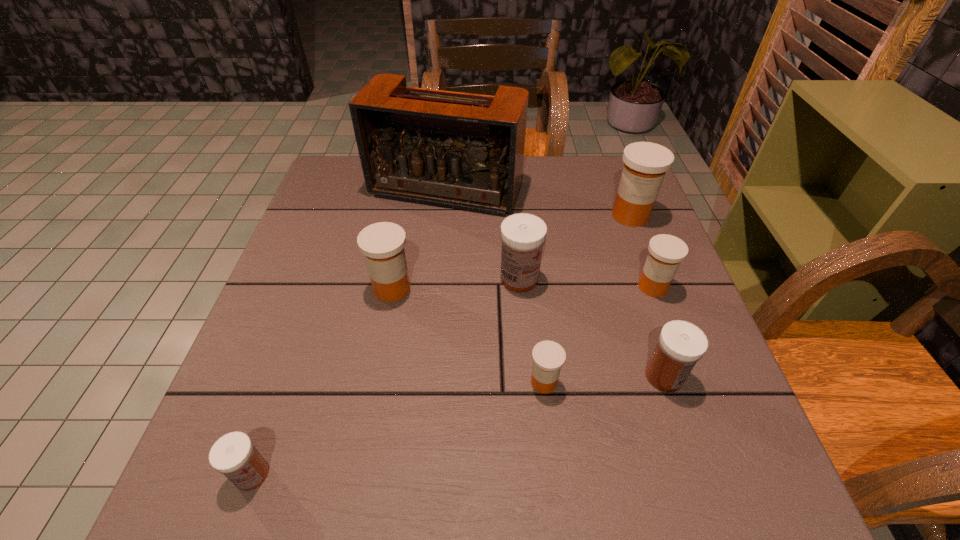
Where is `vacant space located on the label of the nearest orange medicine`? This screenshot has height=540, width=960. vacant space located on the label of the nearest orange medicine is located at coordinates (322, 382).

Find the location of `vacant region located on the label of the nearest orange medicine`. vacant region located on the label of the nearest orange medicine is located at coordinates (360, 382).

Find the location of a particular element. The image size is (960, 540). vacant space located 0.240m on the label of the nearest orange medicine is located at coordinates (397, 382).

At what (x,y) coordinates should I click in order to perform the action: click on free location located on the back of the leftmost white medicine. Please return your answer as a coordinate pair (x, y). Looking at the image, I should click on (x=312, y=302).

You are a GUI agent. You are given a task and a screenshot of the screen. Output one action in this format:
    pyautogui.click(x=<x>, y=<y>)
    Task: Click on the radio receiver that is at the far edge
    
    Given the screenshot: What is the action you would take?
    point(465,151)

At what (x,y) coordinates should I click in order to perform the action: click on medicine located at the far edge. Please return your answer as a coordinate pair (x, y). Looking at the image, I should click on (645, 164).

I want to click on object that is at the near edge, so click(x=234, y=455).

The width and height of the screenshot is (960, 540). I want to click on radio receiver situated at the left edge, so click(465, 151).

At what (x,y) coordinates should I click in order to perform the action: click on medicine that is positioned at the left edge. Please return your answer as a coordinate pair (x, y). The height and width of the screenshot is (540, 960). Looking at the image, I should click on (234, 455).

At what (x,y) coordinates should I click in order to perform the action: click on object situated at the far left corner. Please return your answer as a coordinate pair (x, y). Image resolution: width=960 pixels, height=540 pixels. Looking at the image, I should click on (465, 151).